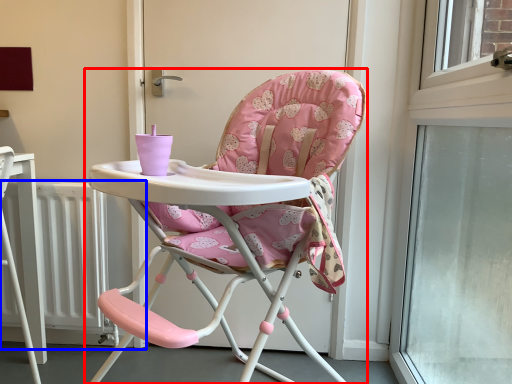
Question: Among these objects, which one is farthest to the camera, chair (highlighted by a red box) or radiator (highlighted by a blue box)?

Choices:
 (A) chair
 (B) radiator

Answer: (B)